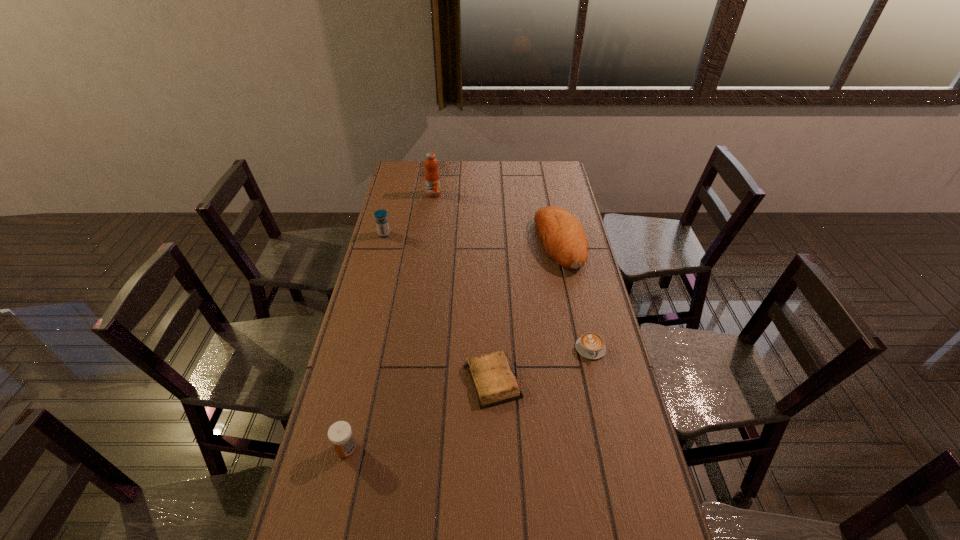
Where is `vacant space situated on the back of the bread`? vacant space situated on the back of the bread is located at coordinates (548, 187).

This screenshot has width=960, height=540. I want to click on free region located 0.170m on the right of the shorter medicine, so click(x=420, y=449).

Locate an element on the screen. The height and width of the screenshot is (540, 960). free space located on the side of the cappuccino with the handle is located at coordinates (601, 395).

Identify the location of vacant area located 0.370m on the left of the diary. The image size is (960, 540). (343, 380).

Locate an element on the screen. The height and width of the screenshot is (540, 960). bread that is positioned at the right edge is located at coordinates (563, 239).

At what (x,y) coordinates should I click in order to perform the action: click on cappuccino present at the right edge. Please return your answer as a coordinate pair (x, y). The height and width of the screenshot is (540, 960). Looking at the image, I should click on (590, 345).

This screenshot has width=960, height=540. In the image, there is a desktop. Identify the location of vacant space at the far edge. (532, 184).

You are a GUI agent. You are given a task and a screenshot of the screen. Output one action in this format:
    pyautogui.click(x=<x>, y=<y>)
    Task: Click on the free location at the left edge of the desktop
    The width and height of the screenshot is (960, 540).
    Given the screenshot: What is the action you would take?
    pyautogui.click(x=412, y=222)

This screenshot has height=540, width=960. Identify the location of free spot at the right edge of the desktop. (589, 296).

I want to click on vacant space at the far left corner of the desktop, so click(400, 165).